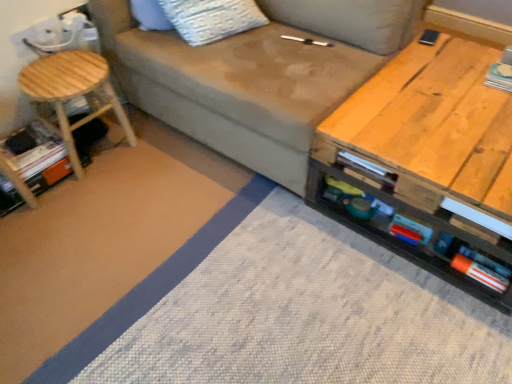
You are a GUI agent. You are given a task and a screenshot of the screen. Output one action in this format:
    pyautogui.click(x=<x>, y=<y>)
    Task: Click on the free space to the left of white paper book at upper right, the 2th book positioned from the left
    The height and width of the screenshot is (384, 512).
    Given the screenshot: What is the action you would take?
    pyautogui.click(x=458, y=78)